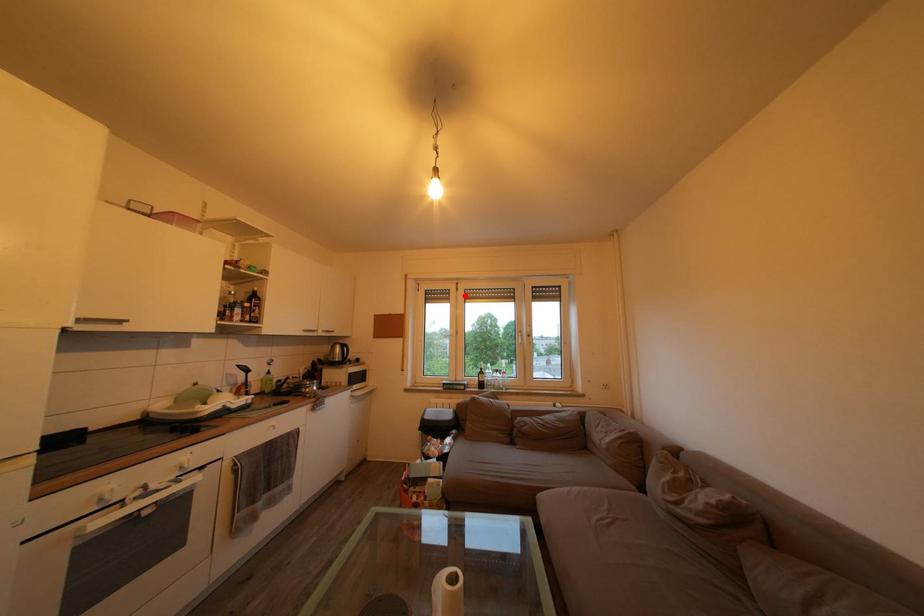
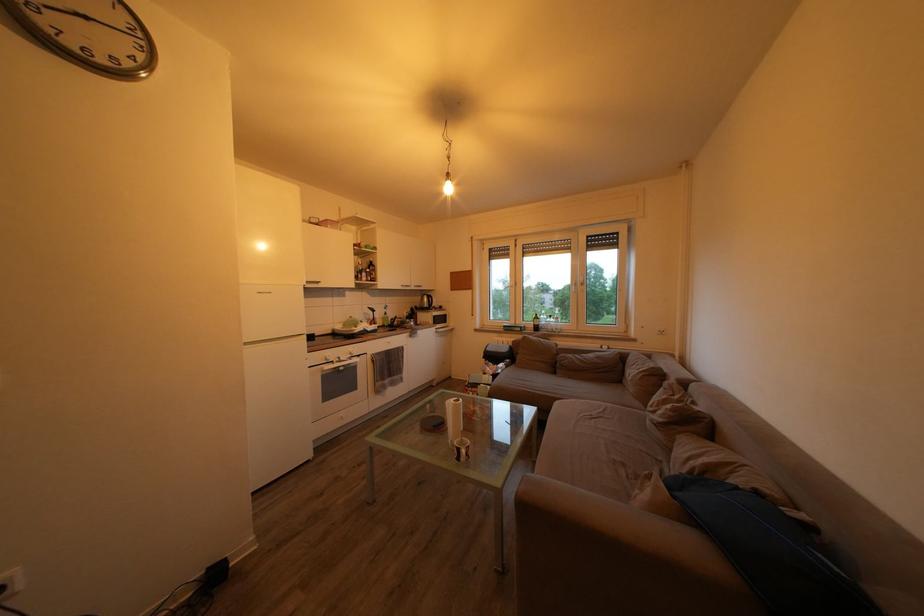
The point at the highlighted location is marked in the first image. Where is the corresponding point in the second image?

(524, 252)